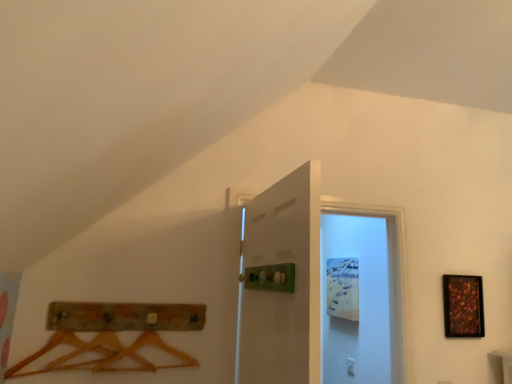
Question: From a real-world perspective, is white matte door at center, arranged as the second door when viewed from the front, physically below white matte door at center, positioned as the 2th door in back-to-front order?

Choices:
 (A) no
 (B) yes

Answer: (A)

Question: Does white matte door at center, which is the first door from back to front, have a greater width compared to white matte door at center, the 1th door from the front?

Choices:
 (A) no
 (B) yes

Answer: (B)

Question: Can you see white matte door at center, arranged as the second door when viewed from the front, touching white matte door at center, the 1th door from the front?

Choices:
 (A) no
 (B) yes

Answer: (A)

Question: Would you say white matte door at center, positioned as the 2th door in back-to-front order, is part of white matte door at center, which is the first door from back to front,'s contents?

Choices:
 (A) no
 (B) yes

Answer: (A)

Question: Considering the relative positions of white matte door at center, the 1th door from the front, and white matte door at center, arranged as the second door when viewed from the front, in the image provided, is white matte door at center, the 1th door from the front, to the left or to the right of white matte door at center, arranged as the second door when viewed from the front,?

Choices:
 (A) right
 (B) left

Answer: (B)

Question: Is white matte door at center, the 1th door from the front, spatially inside white matte door at center, arranged as the second door when viewed from the front, or outside of it?

Choices:
 (A) outside
 (B) inside

Answer: (A)

Question: Is white matte door at center, positioned as the 2th door in back-to-front order, bigger or smaller than white matte door at center, which is the first door from back to front?

Choices:
 (A) small
 (B) big

Answer: (A)

Question: From their relative heights in the image, would you say white matte door at center, the 1th door from the front, is taller or shorter than white matte door at center, which is the first door from back to front?

Choices:
 (A) tall
 (B) short

Answer: (B)

Question: Looking at their shapes, would you say white matte door at center, the 1th door from the front, is wider or thinner than shiny metallic picture frame at right?

Choices:
 (A) thin
 (B) wide

Answer: (B)

Question: Is white matte door at center, the 1th door from the front, bigger or smaller than shiny metallic picture frame at right?

Choices:
 (A) small
 (B) big

Answer: (B)

Question: Is white matte door at center, the 1th door from the front, taller or shorter than shiny metallic picture frame at right?

Choices:
 (A) tall
 (B) short

Answer: (A)

Question: From the image's perspective, is white matte door at center, the 1th door from the front, positioned above or below shiny metallic picture frame at right?

Choices:
 (A) above
 (B) below

Answer: (A)

Question: Looking at their shapes, would you say white matte door at center, which is the first door from back to front, is wider or thinner than shiny metallic picture frame at right?

Choices:
 (A) thin
 (B) wide

Answer: (B)

Question: Considering the positions of white matte door at center, which is the first door from back to front, and shiny metallic picture frame at right in the image, is white matte door at center, which is the first door from back to front, taller or shorter than shiny metallic picture frame at right?

Choices:
 (A) tall
 (B) short

Answer: (A)